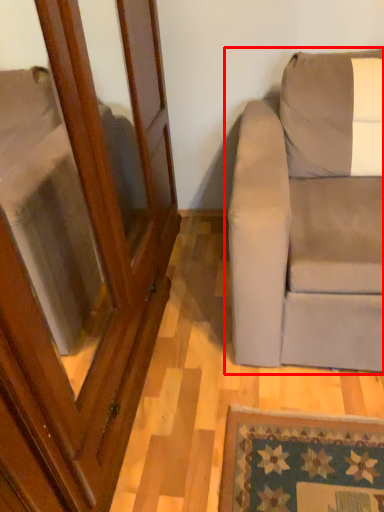
Question: Considering the relative positions of studio couch (annotated by the red box) and screen door in the image provided, where is studio couch (annotated by the red box) located with respect to the staircase?

Choices:
 (A) right
 (B) left

Answer: (A)